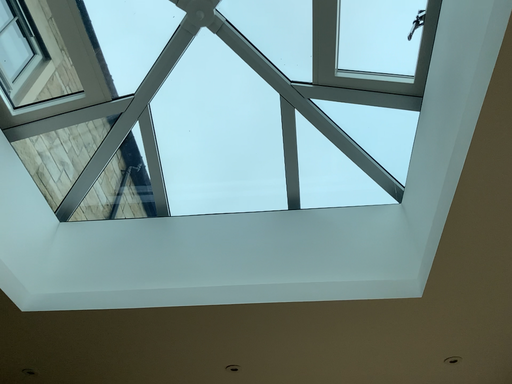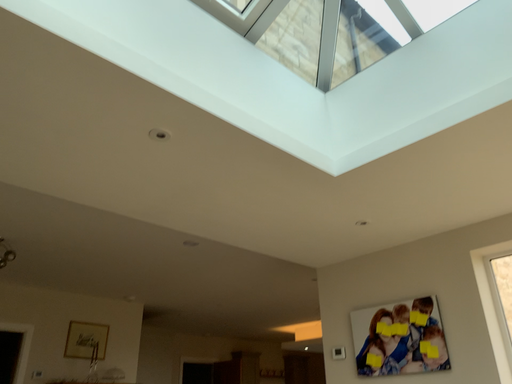
Question: How did the camera likely rotate when shooting the video?

Choices:
 (A) rotated right
 (B) rotated left

Answer: (B)